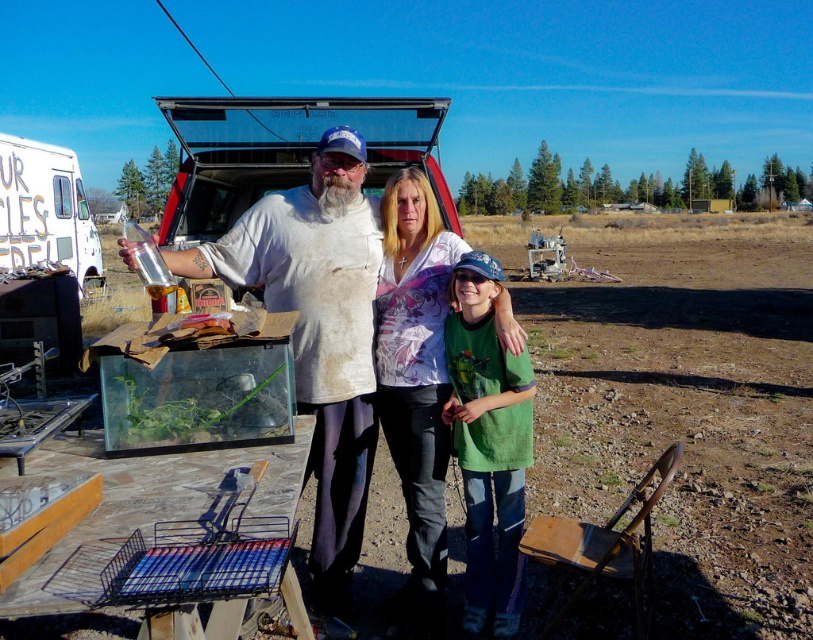
You are a photographer trying to capture both the worn white shirt at center and the green cotton shirt at center in the same frame. Based on their positions, which shirt should you adjust your camera angle to focus on first to ensure both are in view?

The worn white shirt at center is to the left of the green cotton shirt at center, so you should focus on the worn white shirt at center first to ensure both shirts are in the frame.

You are standing at the edge of the dirt ground in the image. You want to locate the matte white blouse at center. According to the coordinate system where the bottom left corner is the origin, which direction should you look to find it?

The matte white blouse at center is located at coordinate point 0.586 on the x axis and 0.512 on the y axis. Since the origin is at the bottom left corner, the x value of 0.586 indicates a position to the right of the center horizontally, and the y value of 0.512 suggests it is slightly above the center vertically. Therefore, you should look towards the upper right direction from the center to locate the matte white blouse at center.

You are a photographer setting up a shoot in this rural area. You need to position a camera on a tripod so that both the worn white shirt at center and the green cotton shirt at center are visible in the frame. Considering their heights, which shirt will appear larger in the photo?

The worn white shirt at center is much taller than the green cotton shirt at center, so it will appear larger in the photo.